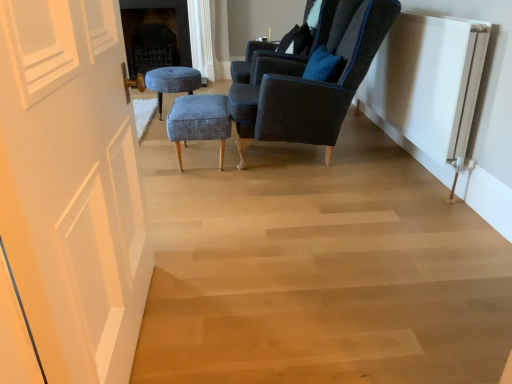
Where is `free space in front of blue fabric stool at center, arranged as the 2th stool when viewed from the left`? The height and width of the screenshot is (384, 512). free space in front of blue fabric stool at center, arranged as the 2th stool when viewed from the left is located at coordinates (200, 188).